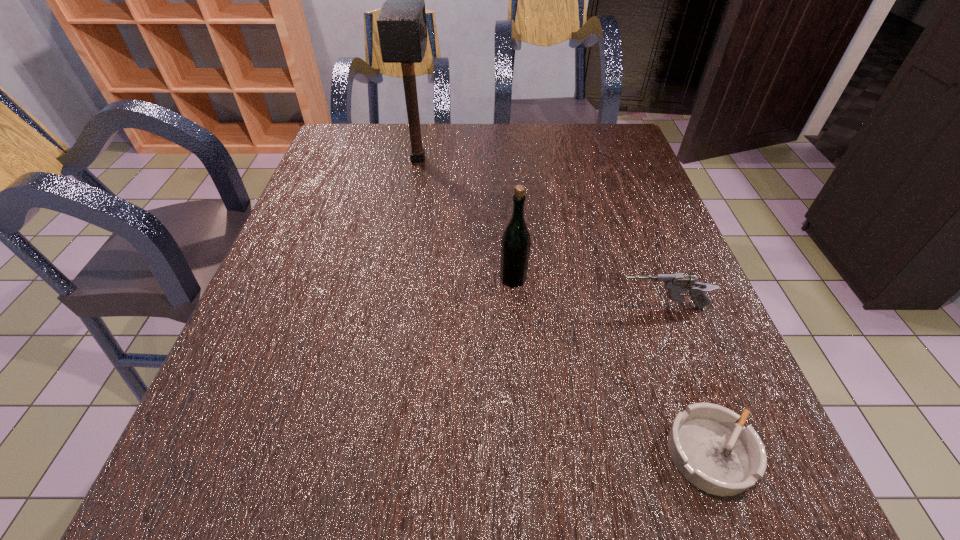
At what (x,y) coordinates should I click in order to perform the action: click on free location located at the barrel of the second nearest object. Please return your answer as a coordinate pair (x, y). This screenshot has height=540, width=960. Looking at the image, I should click on (493, 307).

The height and width of the screenshot is (540, 960). What are the coordinates of `free space located at the barrel of the second nearest object` in the screenshot? It's located at (443, 307).

Locate an element on the screen. This screenshot has width=960, height=540. free space located at the barrel of the second nearest object is located at coordinates (489, 307).

Locate an element on the screen. The width and height of the screenshot is (960, 540). free space located on the back of the shortest object is located at coordinates (668, 338).

You are a GUI agent. You are given a task and a screenshot of the screen. Output one action in this format:
    pyautogui.click(x=<x>, y=<y>)
    Task: Click on the object located at the far edge
    The width and height of the screenshot is (960, 540).
    Given the screenshot: What is the action you would take?
    pyautogui.click(x=401, y=22)

Locate an element on the screen. This screenshot has width=960, height=540. object present at the near edge is located at coordinates (715, 452).

Identify the location of gun located in the right edge section of the desktop. This screenshot has height=540, width=960. (676, 283).

You are a GUI agent. You are given a task and a screenshot of the screen. Output one action in this format:
    pyautogui.click(x=<x>, y=<y>)
    Task: Click on the ashtray present at the right edge
    Image resolution: width=960 pixels, height=540 pixels.
    Given the screenshot: What is the action you would take?
    pyautogui.click(x=715, y=452)

The height and width of the screenshot is (540, 960). What are the coordinates of `object present at the near right corner` in the screenshot? It's located at (715, 452).

Find the location of a particular element. This screenshot has width=960, height=540. vacant space at the far edge of the desktop is located at coordinates (403, 132).